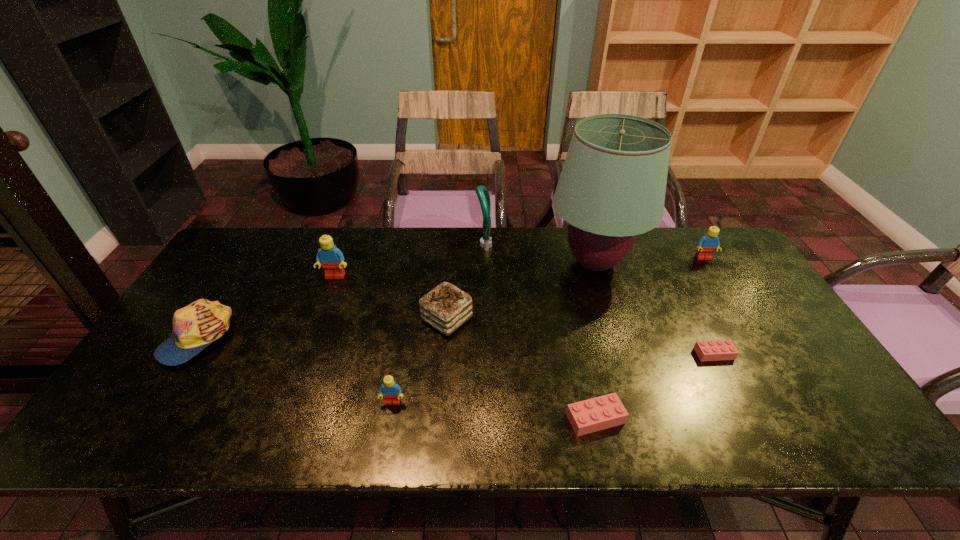
Image resolution: width=960 pixels, height=540 pixels. I want to click on blue lampshade, so click(x=612, y=186).

I want to click on lampshade, so click(x=612, y=186).

Where is `the fifth object from left to right`? The image size is (960, 540). the fifth object from left to right is located at coordinates tap(482, 192).

Where is `green bottle opener`? green bottle opener is located at coordinates (482, 192).

The image size is (960, 540). What are the coordinates of `the second nearest blue Lego` in the screenshot? It's located at (332, 259).

The height and width of the screenshot is (540, 960). What are the coordinates of `the tallest Lego` in the screenshot? It's located at (332, 259).

Image resolution: width=960 pixels, height=540 pixels. I want to click on the farthest blue Lego, so click(707, 244).

This screenshot has height=540, width=960. What are the coordinates of `the rightmost blue Lego` in the screenshot? It's located at (707, 244).

The height and width of the screenshot is (540, 960). In order to click on chocolate cake in this screenshot , I will do `click(446, 308)`.

Where is `cap`? The height and width of the screenshot is (540, 960). cap is located at coordinates tap(196, 326).